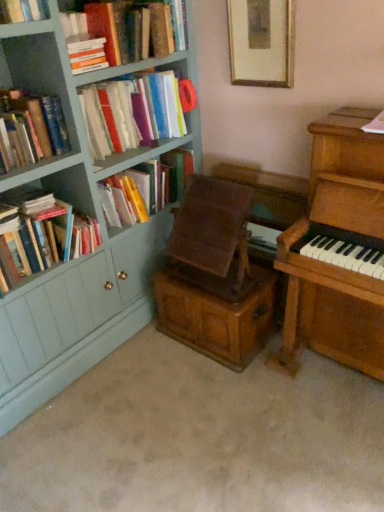
Question: Is wooden picture frame at upper center outside hardcover books at left, which is counted as the first book, starting from the bottom?

Choices:
 (A) yes
 (B) no

Answer: (A)

Question: Is wooden picture frame at upper center aimed at hardcover books at left, the 6th book in the top-to-bottom sequence?

Choices:
 (A) no
 (B) yes

Answer: (A)

Question: Can you confirm if wooden picture frame at upper center is positioned to the left of hardcover books at left, the 6th book in the top-to-bottom sequence?

Choices:
 (A) no
 (B) yes

Answer: (A)

Question: From the image's perspective, would you say wooden picture frame at upper center is positioned over hardcover books at left, which is counted as the first book, starting from the bottom?

Choices:
 (A) yes
 (B) no

Answer: (A)

Question: Does wooden picture frame at upper center lie in front of hardcover books at left, which is counted as the first book, starting from the bottom?

Choices:
 (A) yes
 (B) no

Answer: (B)

Question: From the image's perspective, is hardcover book at left, the 5th book viewed from the top, positioned above or below hardcover books at upper left, which appears as the first book when viewed from the top?

Choices:
 (A) above
 (B) below

Answer: (B)

Question: From their relative heights in the image, would you say hardcover book at left, the 5th book viewed from the top, is taller or shorter than hardcover books at upper left, the 6th book ordered from the bottom?

Choices:
 (A) tall
 (B) short

Answer: (A)

Question: Is hardcover book at left, the 2th book ordered from the bottom, situated inside hardcover books at upper left, the 6th book ordered from the bottom, or outside?

Choices:
 (A) inside
 (B) outside

Answer: (B)

Question: Based on their positions, is hardcover book at left, the 5th book viewed from the top, located to the left or right of hardcover books at upper left, which appears as the first book when viewed from the top?

Choices:
 (A) left
 (B) right

Answer: (B)

Question: In terms of height, does wooden chest at center look taller or shorter compared to hardcover books at upper left, the third book from the top?

Choices:
 (A) short
 (B) tall

Answer: (A)

Question: Is wooden chest at center situated inside hardcover books at upper left, the fourth book positioned from the bottom, or outside?

Choices:
 (A) outside
 (B) inside

Answer: (A)

Question: From a real-world perspective, is wooden chest at center positioned above or below hardcover books at upper left, the third book from the top?

Choices:
 (A) below
 (B) above

Answer: (A)

Question: Does point (256, 342) appear closer or farther from the camera than point (94, 135)?

Choices:
 (A) closer
 (B) farther

Answer: (B)

Question: Based on their sizes in the image, would you say hardcover book at upper left, which is the 5th book from bottom to top, is bigger or smaller than wooden chest at center?

Choices:
 (A) small
 (B) big

Answer: (A)

Question: Is hardcover book at upper left, arranged as the 2th book when viewed from the top, spatially inside wooden chest at center, or outside of it?

Choices:
 (A) inside
 (B) outside

Answer: (B)